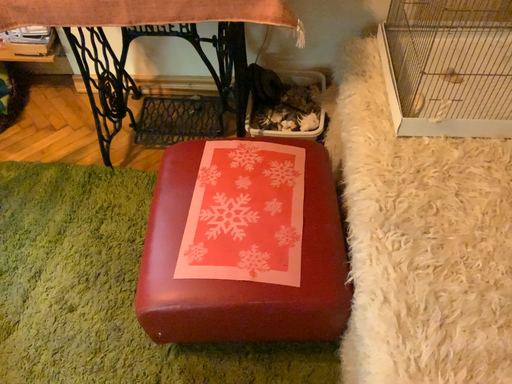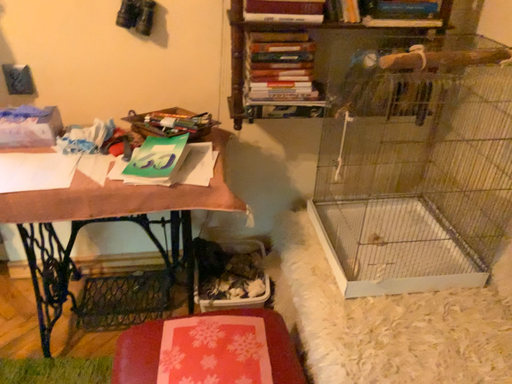
Question: Which way did the camera rotate in the video?

Choices:
 (A) rotated downward
 (B) rotated upward

Answer: (B)